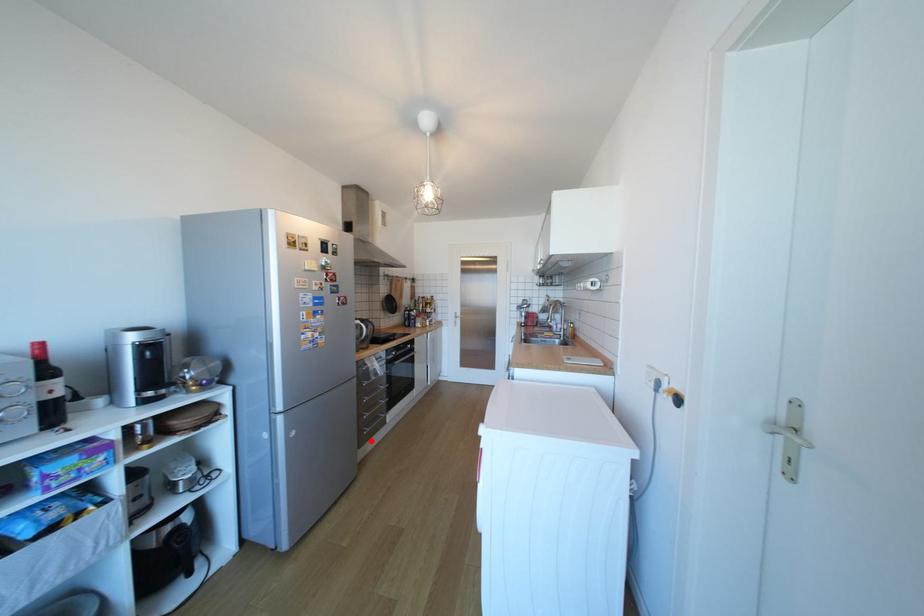
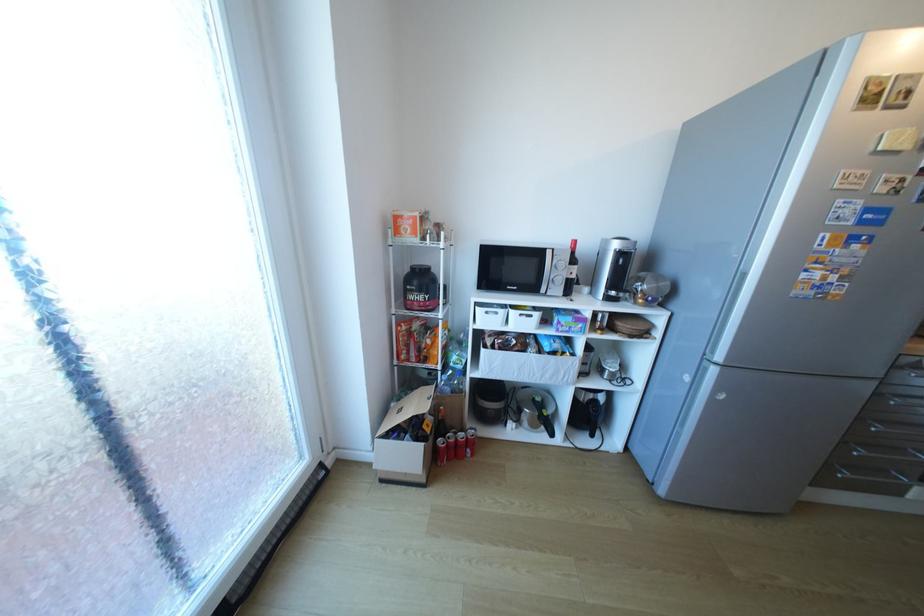
Where in the second image is the point corresponding to the highlighted location from the first image?

(834, 480)